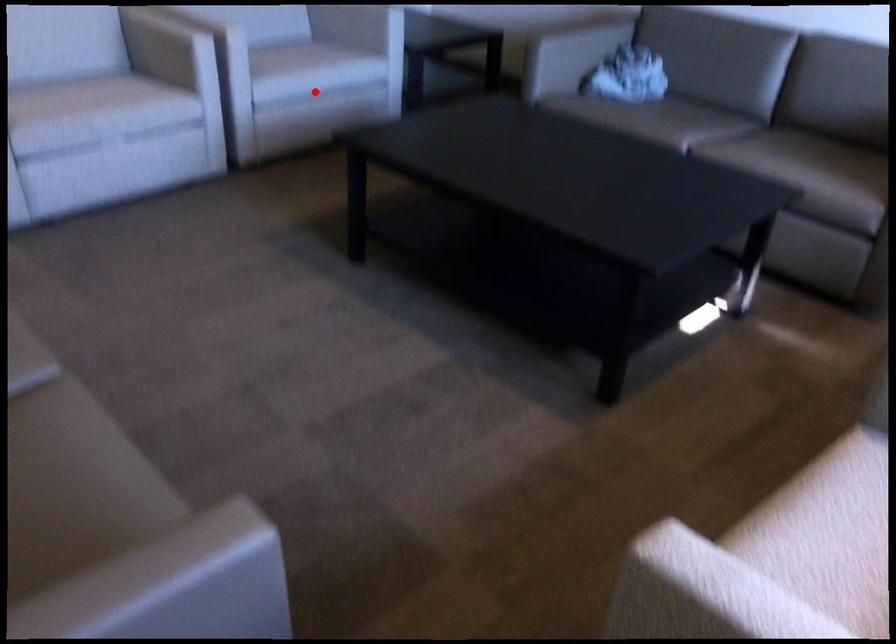
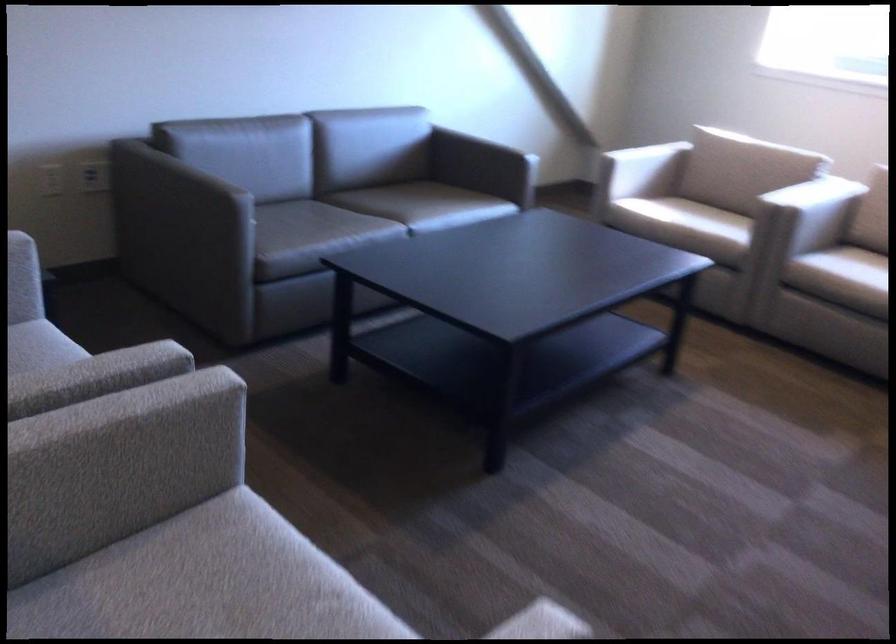
Question: I am providing you with two images of the same scene from different viewpoints. A red point is marked on the first image. Can you still see the location of the red point in image 2?

Choices:
 (A) Yes
 (B) No

Answer: (B)